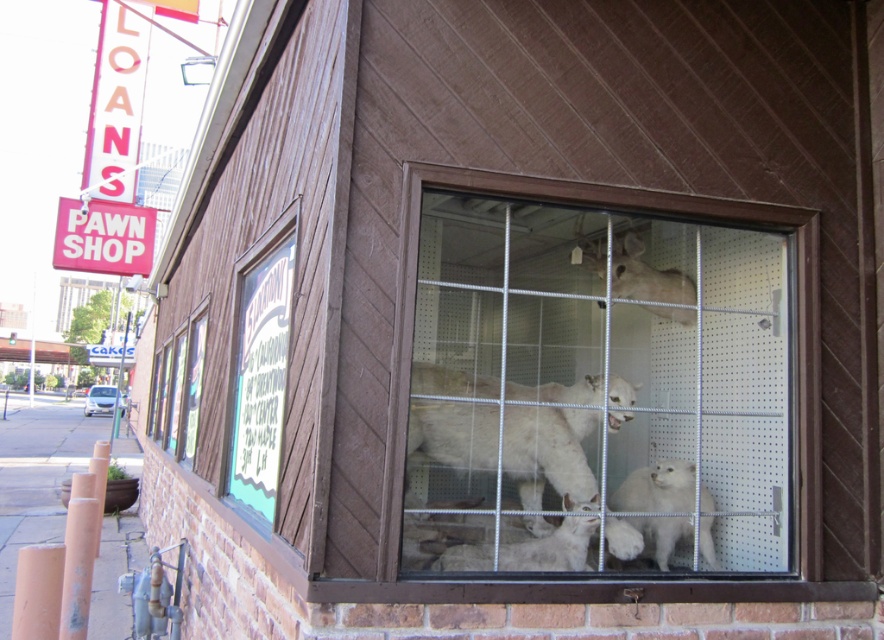
Can you confirm if white fur taxidermy animals at center is wider than white fur deer at upper center?

Yes.

Is white fur taxidermy animals at center behind white fur deer at upper center?

No, it is not.

Where is `white fur taxidermy animals at center`? The height and width of the screenshot is (640, 884). white fur taxidermy animals at center is located at coordinates (600, 380).

Can you confirm if white fluffy lamb at center is positioned to the left of white fur deer at upper center?

In fact, white fluffy lamb at center is to the right of white fur deer at upper center.

This screenshot has width=884, height=640. What do you see at coordinates (657, 488) in the screenshot?
I see `white fluffy lamb at center` at bounding box center [657, 488].

Who is more forward, [705,497] or [587,244]?

Point [705,497] is in front.

Locate an element on the screen. Image resolution: width=884 pixels, height=640 pixels. white fluffy lamb at center is located at coordinates (657, 488).

Between point (552, 243) and point (660, 544), which one is positioned behind?

The point (552, 243) is behind.

The image size is (884, 640). Identify the location of white fur taxidermy animals at center. (600, 380).